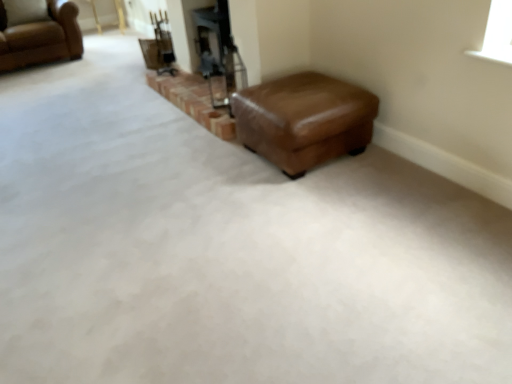
Question: Can you confirm if brown leather chair at upper left is smaller than brown leather ottoman at center?

Choices:
 (A) yes
 (B) no

Answer: (B)

Question: Could brown leather ottoman at center be considered to be inside brown leather chair at upper left?

Choices:
 (A) no
 (B) yes

Answer: (A)

Question: Does brown leather chair at upper left lie in front of brown leather ottoman at center?

Choices:
 (A) no
 (B) yes

Answer: (A)

Question: Can you confirm if brown leather chair at upper left is taller than brown leather ottoman at center?

Choices:
 (A) no
 (B) yes

Answer: (B)

Question: Does brown leather chair at upper left have a lesser width compared to brown leather ottoman at center?

Choices:
 (A) yes
 (B) no

Answer: (B)

Question: Is brown leather chair at upper left turned away from brown leather ottoman at center?

Choices:
 (A) no
 (B) yes

Answer: (A)

Question: Considering the relative sizes of brown leather ottoman at center and brown leather chair at upper left in the image provided, is brown leather ottoman at center thinner than brown leather chair at upper left?

Choices:
 (A) yes
 (B) no

Answer: (A)

Question: Is brown leather ottoman at center oriented away from brown leather chair at upper left?

Choices:
 (A) no
 (B) yes

Answer: (A)

Question: Considering the relative sizes of brown leather ottoman at center and brown leather chair at upper left in the image provided, is brown leather ottoman at center smaller than brown leather chair at upper left?

Choices:
 (A) yes
 (B) no

Answer: (A)

Question: Is the position of brown leather ottoman at center less distant than that of brown leather chair at upper left?

Choices:
 (A) no
 (B) yes

Answer: (B)

Question: From a real-world perspective, is brown leather ottoman at center on brown leather chair at upper left?

Choices:
 (A) no
 (B) yes

Answer: (A)

Question: Is brown leather ottoman at center touching brown leather chair at upper left?

Choices:
 (A) no
 (B) yes

Answer: (A)

Question: Is brown leather ottoman at center to the left or to the right of brown leather chair at upper left in the image?

Choices:
 (A) right
 (B) left

Answer: (A)